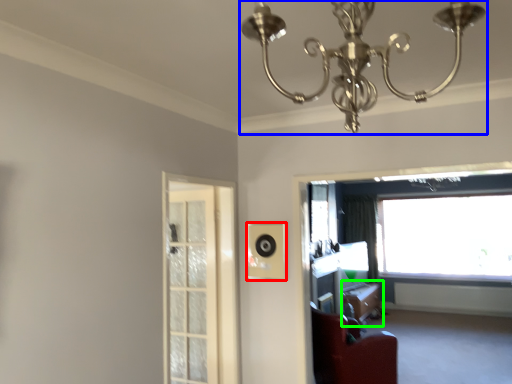
Question: Which object is positioned farthest from speaker (highlighted by a red box)? Select from lamp (highlighted by a blue box) and table (highlighted by a green box).

Choices:
 (A) lamp
 (B) table

Answer: (B)